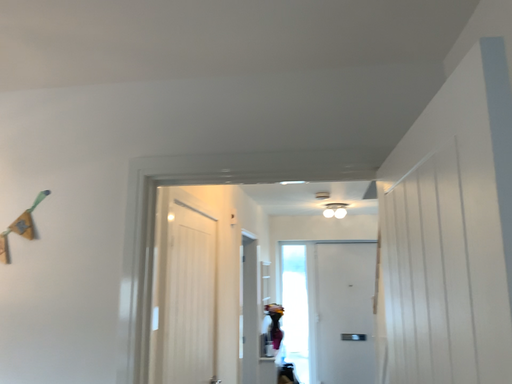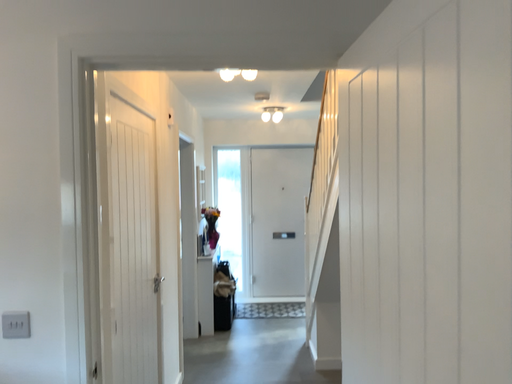
Question: How did the camera likely rotate when shooting the video?

Choices:
 (A) rotated upward
 (B) rotated downward

Answer: (B)